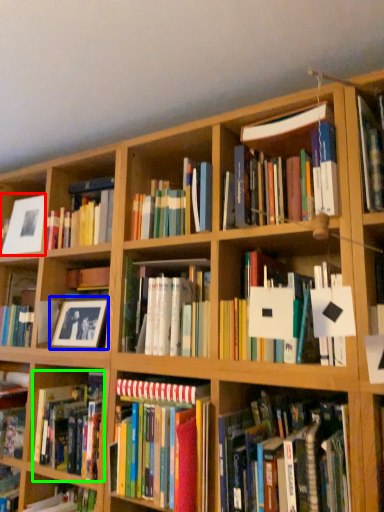
Question: Which is farther away from picture frame (highlighted by a red box)? picture frame (highlighted by a blue box) or book (highlighted by a green box)?

Choices:
 (A) picture frame
 (B) book

Answer: (B)